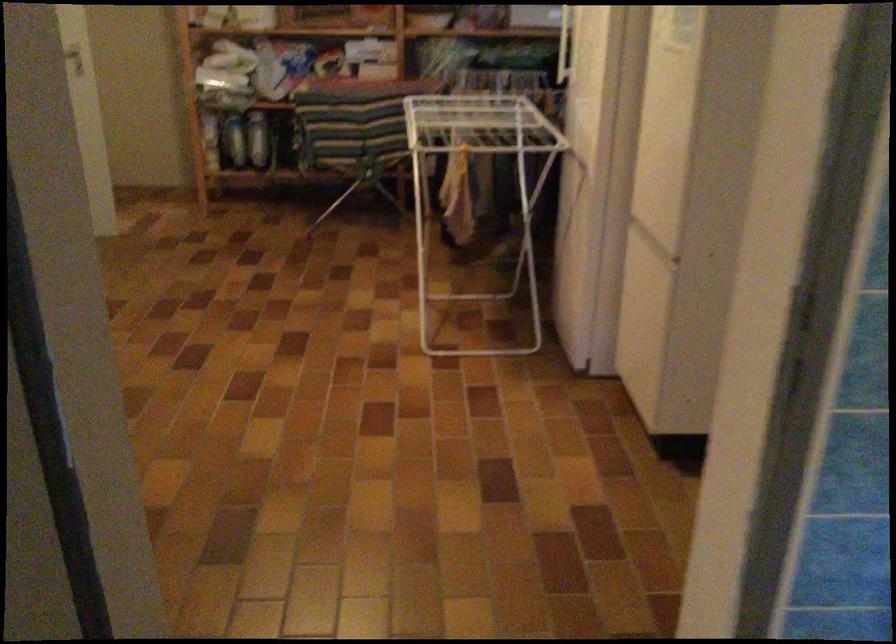
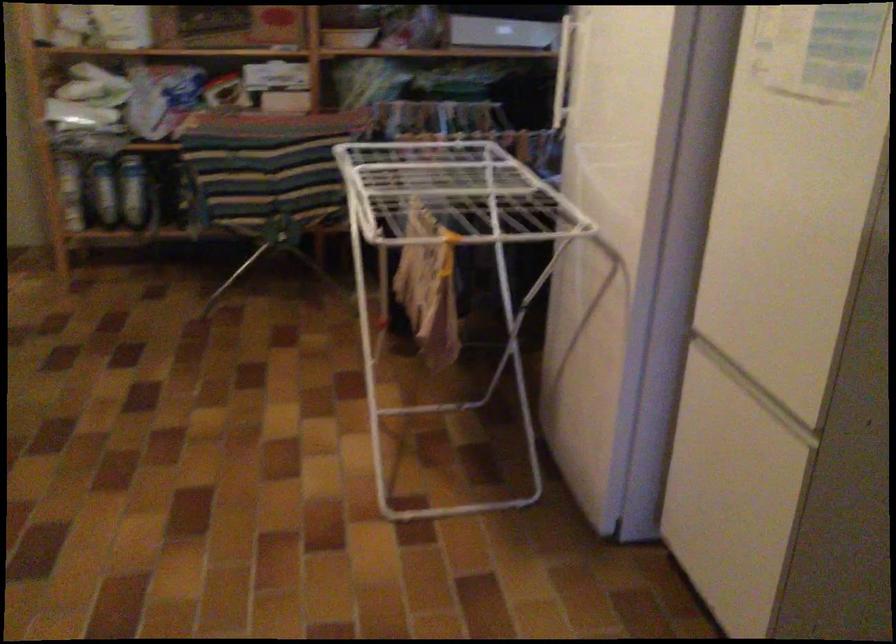
Question: In a continuous first-person perspective shot, in which direction is the camera moving?

Choices:
 (A) Left
 (B) Right
 (C) Forward
 (D) Backward

Answer: (C)